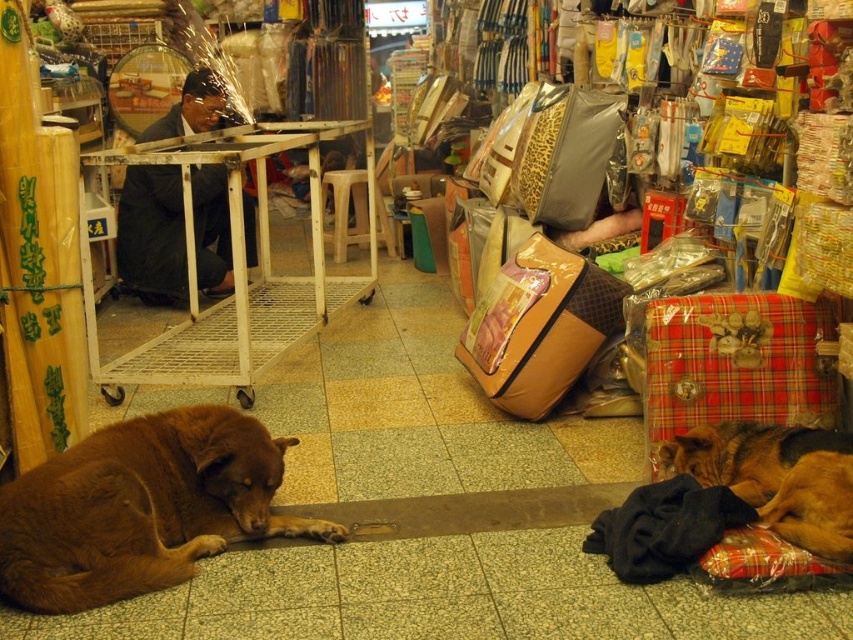
Question: Can you confirm if brown furry dog at lower left is positioned to the right of brown furry dog at lower right?

Choices:
 (A) yes
 (B) no

Answer: (B)

Question: Which of the following is the farthest from the observer?

Choices:
 (A) (91, 561)
 (B) (831, 502)
 (C) (138, 289)

Answer: (C)

Question: Which of the following is the farthest from the observer?

Choices:
 (A) brown furry dog at lower right
 (B) brown furry dog at lower left
 (C) dark suit at center

Answer: (C)

Question: Based on their relative distances, which object is nearer to the dark suit at center?

Choices:
 (A) brown furry dog at lower right
 (B) brown furry dog at lower left

Answer: (B)

Question: Is dark suit at center below brown furry dog at lower right?

Choices:
 (A) no
 (B) yes

Answer: (A)

Question: Observing the image, what is the correct spatial positioning of brown furry dog at lower left in reference to dark suit at center?

Choices:
 (A) below
 (B) above

Answer: (A)